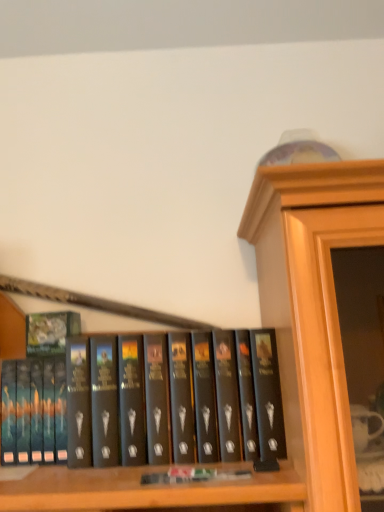
At what (x,y) coordinates should I click in order to perform the action: click on black matte book at center. Please return your answer as a coordinate pair (x, y). Looking at the image, I should click on (151, 401).

Describe the element at coordinates (151, 401) in the screenshot. Image resolution: width=384 pixels, height=512 pixels. I see `black matte book at center` at that location.

Describe the element at coordinates (50, 332) in the screenshot. The width and height of the screenshot is (384, 512). I see `green matte book at left` at that location.

You are a GUI agent. You are given a task and a screenshot of the screen. Output one action in this format:
    pyautogui.click(x=<x>, y=<y>)
    Task: Click on the green matte book at left
    
    Given the screenshot: What is the action you would take?
    pyautogui.click(x=50, y=332)

This screenshot has height=512, width=384. I want to click on black matte book at center, so click(x=151, y=401).

In the scene shown: Between black matte book at center and green matte book at left, which one appears on the left side from the viewer's perspective?

Positioned to the left is green matte book at left.

Which is behind, black matte book at center or green matte book at left?

green matte book at left is behind.

Is point (218, 423) positioned behind point (44, 320)?

No, (218, 423) is in front of (44, 320).

From the image's perspective, would you say black matte book at center is shown under green matte book at left?

Indeed, from the image's perspective, black matte book at center is shown beneath green matte book at left.

From a real-world perspective, is black matte book at center positioned over green matte book at left based on gravity?

Incorrect, from a real-world perspective, black matte book at center is lower than green matte book at left.

Looking at their sizes, would you say black matte book at center is wider or thinner than green matte book at left?

Clearly, black matte book at center has more width compared to green matte book at left.

Can you confirm if black matte book at center is shorter than green matte book at left?

In fact, black matte book at center may be taller than green matte book at left.

Considering the relative sizes of black matte book at center and green matte book at left in the image provided, is black matte book at center bigger than green matte book at left?

Yes.

Would you say black matte book at center is outside green matte book at left?

black matte book at center lies outside green matte book at left's area.

Is black matte book at center in contact with green matte book at left?

There is a gap between black matte book at center and green matte book at left.

Is black matte book at center turned away from green matte book at left?

No, black matte book at center is not facing away from green matte book at left.

How distant is black matte book at center from green matte book at left?

black matte book at center and green matte book at left are 19.46 centimeters apart.

Locate an element on the screen. The image size is (384, 512). book cover behind the black matte book at center is located at coordinates (50, 332).

Between green matte book at left and black matte book at center, which one appears on the left side from the viewer's perspective?

green matte book at left.

In the scene shown: Does green matte book at left lie in front of black matte book at center?

No.

Is point (46, 336) closer or farther from the camera than point (151, 374)?

Clearly, point (46, 336) is more distant from the camera than point (151, 374).

From the image's perspective, is green matte book at left above black matte book at center?

Yes.

From a real-world perspective, which object stands above the other?

In real-world perspective, green matte book at left is above.

Looking at their sizes, would you say green matte book at left is wider or thinner than black matte book at center?

Considering their sizes, green matte book at left looks slimmer than black matte book at center.

In terms of height, does green matte book at left look taller or shorter compared to black matte book at center?

In the image, green matte book at left appears to be shorter than black matte book at center.

Can you confirm if green matte book at left is bigger than black matte book at center?

Incorrect, green matte book at left is not larger than black matte book at center.

Based on the photo, is green matte book at left inside or outside of black matte book at center?

green matte book at left is inside black matte book at center.

Does green matte book at left touch black matte book at center?

They are not placed beside each other.

Is green matte book at left facing towards black matte book at center?

No.

From the picture: How many degrees apart are the facing directions of green matte book at left and black matte book at center?

green matte book at left and black matte book at center are facing 1.41 degrees away from each other.

At what (x,y) coordinates should I click in order to perform the action: click on book below the green matte book at left (from the image's perspective). Please return your answer as a coordinate pair (x, y). Image resolution: width=384 pixels, height=512 pixels. Looking at the image, I should click on (151, 401).

Identify the location of book lying in front of the green matte book at left. The width and height of the screenshot is (384, 512). (151, 401).

I want to click on book cover that appears on the left of black matte book at center, so click(50, 332).